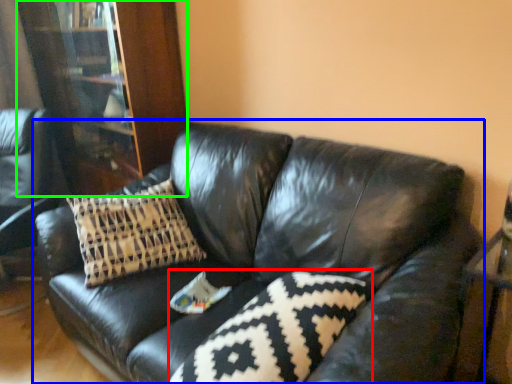
Question: Which object is positioned farthest from pillow (highlighted by a red box)? Select from studio couch (highlighted by a blue box) and bookcase (highlighted by a green box).

Choices:
 (A) studio couch
 (B) bookcase

Answer: (B)